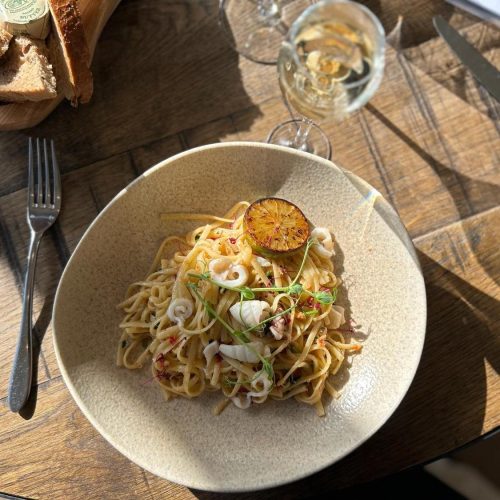
Where is `handle of fork`? The height and width of the screenshot is (500, 500). handle of fork is located at coordinates (18, 375).